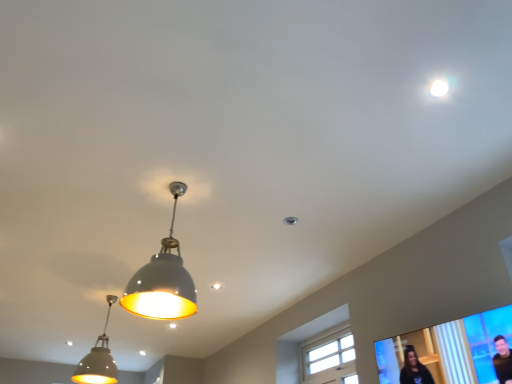
Question: Does matte black screen at lower right lie in front of matte gray lampshade at center, which is the 2th lamp from left to right?

Choices:
 (A) yes
 (B) no

Answer: (A)

Question: Is matte black screen at lower right facing away from matte gray lampshade at center, which is the 2th lamp in back-to-front order?

Choices:
 (A) yes
 (B) no

Answer: (B)

Question: Is matte black screen at lower right facing towards matte gray lampshade at center, arranged as the first lamp when viewed from the top?

Choices:
 (A) yes
 (B) no

Answer: (B)

Question: Are matte black screen at lower right and matte gray lampshade at center, which ranks as the 2th lamp in bottom-to-top order, located far from each other?

Choices:
 (A) no
 (B) yes

Answer: (B)

Question: From the image's perspective, is matte black screen at lower right over matte gray lampshade at center, which is the 2th lamp in back-to-front order?

Choices:
 (A) yes
 (B) no

Answer: (B)

Question: From the image's perspective, is matte black screen at lower right located beneath matte gray lampshade at center, arranged as the first lamp when viewed from the top?

Choices:
 (A) no
 (B) yes

Answer: (B)

Question: Does matte gray lampshade at center, which is the 2th lamp from left to right, have a greater height compared to matte gray pendant light at lower left, which is counted as the second lamp, starting from the top?

Choices:
 (A) yes
 (B) no

Answer: (A)

Question: Is matte gray lampshade at center, which is the 2th lamp in back-to-front order, wider than matte gray pendant light at lower left, which ranks as the 2th lamp in right-to-left order?

Choices:
 (A) no
 (B) yes

Answer: (A)

Question: Is matte gray lampshade at center, which ranks as the 2th lamp in bottom-to-top order, thinner than matte gray pendant light at lower left, which ranks as the 2th lamp in right-to-left order?

Choices:
 (A) yes
 (B) no

Answer: (A)

Question: From a real-world perspective, does matte gray lampshade at center, which is the 2th lamp from left to right, stand above matte gray pendant light at lower left, which appears as the 1th lamp when ordered from the bottom?

Choices:
 (A) no
 (B) yes

Answer: (A)

Question: Are matte gray lampshade at center, which is the 2th lamp in back-to-front order, and matte gray pendant light at lower left, which is the 1th lamp from back to front, making contact?

Choices:
 (A) no
 (B) yes

Answer: (A)

Question: Would you say matte gray lampshade at center, which is the 2th lamp from left to right, is a long distance from matte gray pendant light at lower left, which is counted as the first lamp, starting from the left?

Choices:
 (A) yes
 (B) no

Answer: (A)

Question: Is white glossy droplight at upper right inside matte black screen at lower right?

Choices:
 (A) no
 (B) yes

Answer: (A)